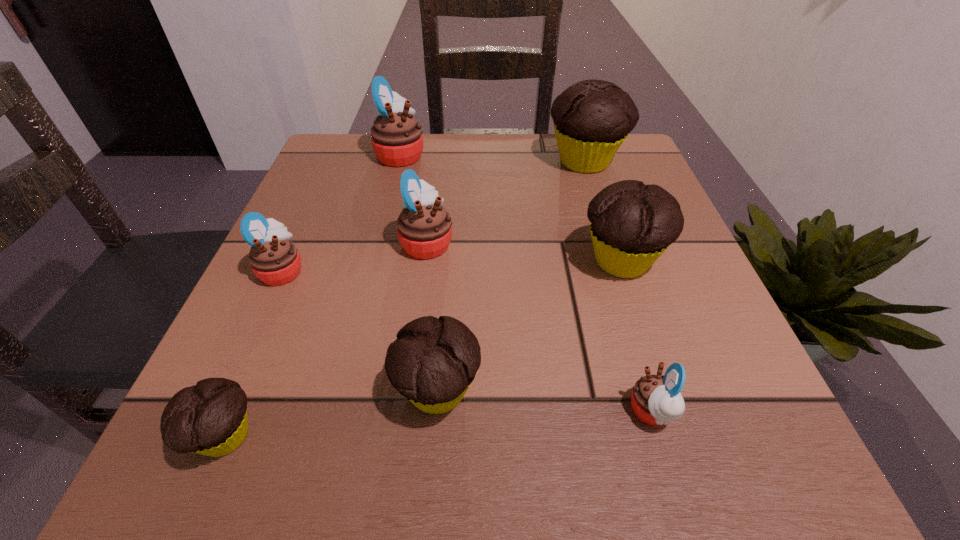
Where is `free space located 0.070m on the left of the biggest chocolate muffin`? The width and height of the screenshot is (960, 540). free space located 0.070m on the left of the biggest chocolate muffin is located at coordinates (515, 161).

Identify the location of vacant position located on the front-facing side of the third smallest pink muffin. (672, 242).

You are a GUI agent. You are given a task and a screenshot of the screen. Output one action in this format:
    pyautogui.click(x=<x>, y=<y>)
    Task: Click on the free space located 0.320m on the back of the third nearest chocolate muffin
    The height and width of the screenshot is (540, 960).
    Given the screenshot: What is the action you would take?
    pyautogui.click(x=585, y=148)

Where is `free spot located 0.380m on the front-facing side of the second smallest pink muffin`? The width and height of the screenshot is (960, 540). free spot located 0.380m on the front-facing side of the second smallest pink muffin is located at coordinates (527, 270).

Find the location of a particular element. Image resolution: width=960 pixels, height=540 pixels. vacant region located on the left of the second chocolate muffin from left to right is located at coordinates (224, 391).

Locate an element on the screen. free spot located 0.200m on the front-facing side of the smallest pink muffin is located at coordinates (474, 412).

Find the location of a particular element. free space located on the front-facing side of the smallest pink muffin is located at coordinates (536, 412).

Where is `blank space located on the front-facing side of the smallest pink muffin`? blank space located on the front-facing side of the smallest pink muffin is located at coordinates (327, 412).

The width and height of the screenshot is (960, 540). In order to click on vacant space situated on the right of the smallest chocolate muffin in this screenshot , I will do `click(551, 436)`.

The image size is (960, 540). I want to click on object at the far left corner, so click(x=397, y=140).